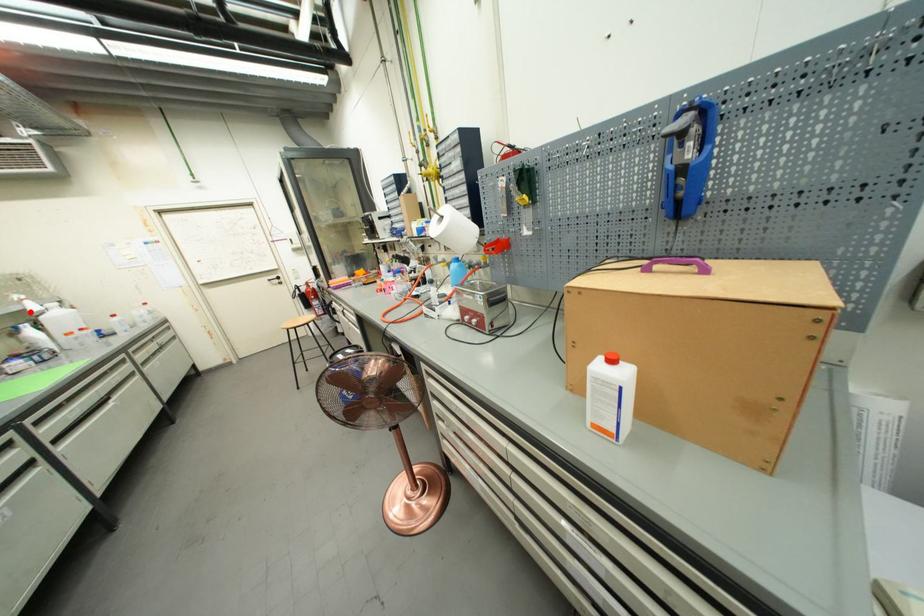
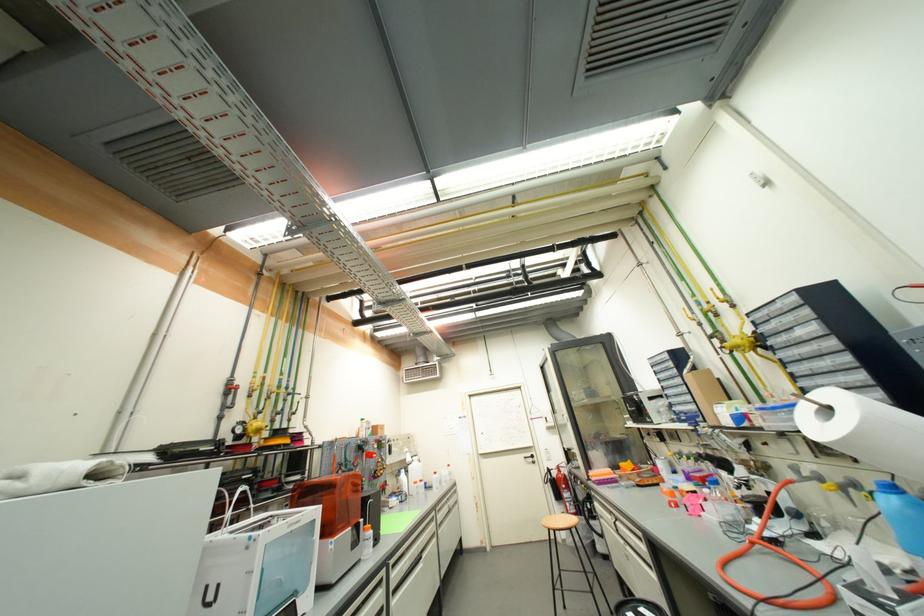
Find the pixel in the second image that matches the highlighted location in the first image.

(410, 461)